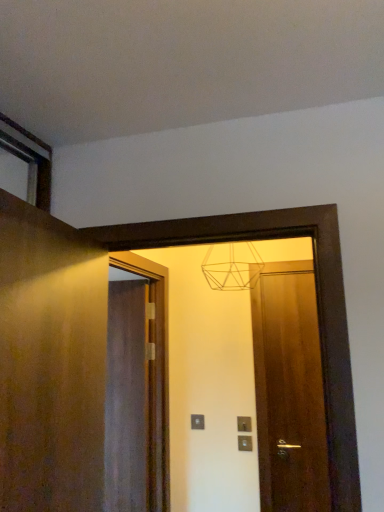
Question: Would you say wooden door at left, acting as the 1th door starting from the left, contains matte gray electric outlet at center, which is the second electric outlet from right to left?

Choices:
 (A) yes
 (B) no

Answer: (B)

Question: Is wooden door at left, the third door from the right, closer to the viewer compared to matte gray electric outlet at center, which is the second electric outlet from right to left?

Choices:
 (A) yes
 (B) no

Answer: (A)

Question: Is there a large distance between wooden door at left, the third door from the right, and matte gray electric outlet at center, arranged as the 1th electric outlet when viewed from the left?

Choices:
 (A) yes
 (B) no

Answer: (A)

Question: Is wooden door at left, the third door from the right, taller than matte gray electric outlet at center, which is the second electric outlet from right to left?

Choices:
 (A) no
 (B) yes

Answer: (B)

Question: From a real-world perspective, is wooden door at left, the third door from the right, located higher than matte gray electric outlet at center, which is the second electric outlet from right to left?

Choices:
 (A) no
 (B) yes

Answer: (B)

Question: From a real-world perspective, is matte brown door at center, the 2th door viewed from the front, physically located above or below matte wooden mirror at center?

Choices:
 (A) below
 (B) above

Answer: (A)

Question: From the image's perspective, is matte brown door at center, the 1th door positioned from the right, positioned above or below matte wooden mirror at center?

Choices:
 (A) below
 (B) above

Answer: (A)

Question: Does point (296, 458) appear closer or farther from the camera than point (322, 488)?

Choices:
 (A) farther
 (B) closer

Answer: (A)

Question: Visually, is matte brown door at center, the 1th door positioned from the right, positioned to the left or to the right of matte wooden mirror at center?

Choices:
 (A) left
 (B) right

Answer: (B)

Question: Is matte gray electric outlet at center, arranged as the 1th electric outlet when viewed from the left, in front of or behind satin silver switch at center, the first electric outlet positioned from the right, in the image?

Choices:
 (A) behind
 (B) front

Answer: (A)

Question: Considering the positions of matte gray electric outlet at center, which is the first electric outlet in back-to-front order, and satin silver switch at center, arranged as the second electric outlet when viewed from the back, in the image, is matte gray electric outlet at center, which is the first electric outlet in back-to-front order, taller or shorter than satin silver switch at center, arranged as the second electric outlet when viewed from the back,?

Choices:
 (A) short
 (B) tall

Answer: (A)

Question: From the image's perspective, relative to satin silver switch at center, which is counted as the 1th electric outlet, starting from the front, is matte gray electric outlet at center, which is the first electric outlet in back-to-front order, above or below?

Choices:
 (A) below
 (B) above

Answer: (A)

Question: From a real-world perspective, is matte gray electric outlet at center, the 2th electric outlet in the front-to-back sequence, positioned above or below satin silver switch at center, which is the second electric outlet in left-to-right order?

Choices:
 (A) below
 (B) above

Answer: (B)

Question: Is point (291, 507) positioned closer to the camera than point (273, 323)?

Choices:
 (A) farther
 (B) closer

Answer: (B)

Question: Is matte wooden mirror at center taller or shorter than matte brown door at center, the 1th door positioned from the right?

Choices:
 (A) short
 (B) tall

Answer: (A)